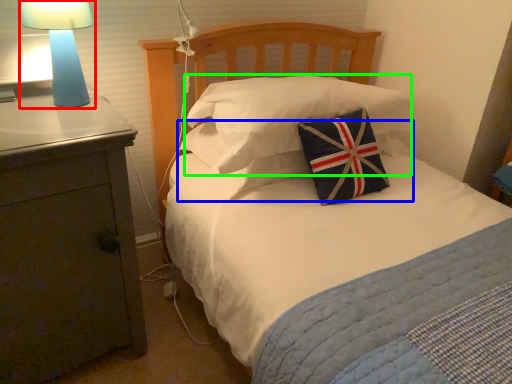
Question: Which is nearer to the lamp (highlighted by a red box)? pillow (highlighted by a blue box) or pillow (highlighted by a green box).

Choices:
 (A) pillow
 (B) pillow

Answer: (A)